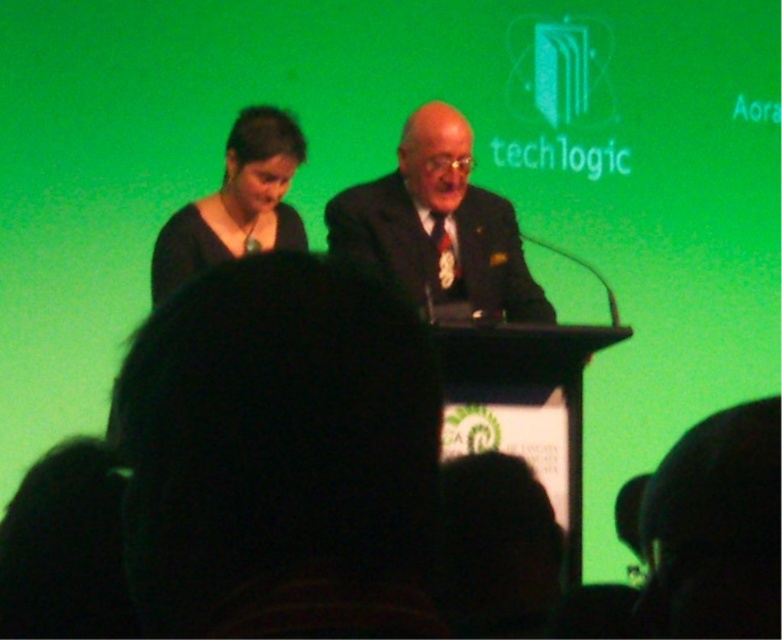
You are attending a formal event and need to choose an outfit that is more eye catching. Based on the scene description, which of the following would you choose between the dark suit at center and the matte black dress at upper left?

The dark suit at center is larger in size than the matte black dress at upper left, so it would be more eye catching due to its larger size.

You are an event organizer who needs to ensure that the distance between the dark suit at center and the nearest exit is safe for emergency evacuation. The safety regulation requires a minimum distance of 5 meters between any attendee and the nearest exit. Can you confirm if the current setup meets this requirement?

The distance between the dark suit at center and the nearest exit is 6.68 meters, which exceeds the required 5 meters, so the setup meets the safety requirement.

You are an attendee at the event and want to know who is closer to the audience. Based on their positions, which of the two individuals, the dark suit at center or the matte black dress at upper left, is closer to the audience?

The dark suit at center is closer to the audience because it is positioned under the matte black dress at upper left, meaning it is lower in the image and likely closer to the front where the audience is located.